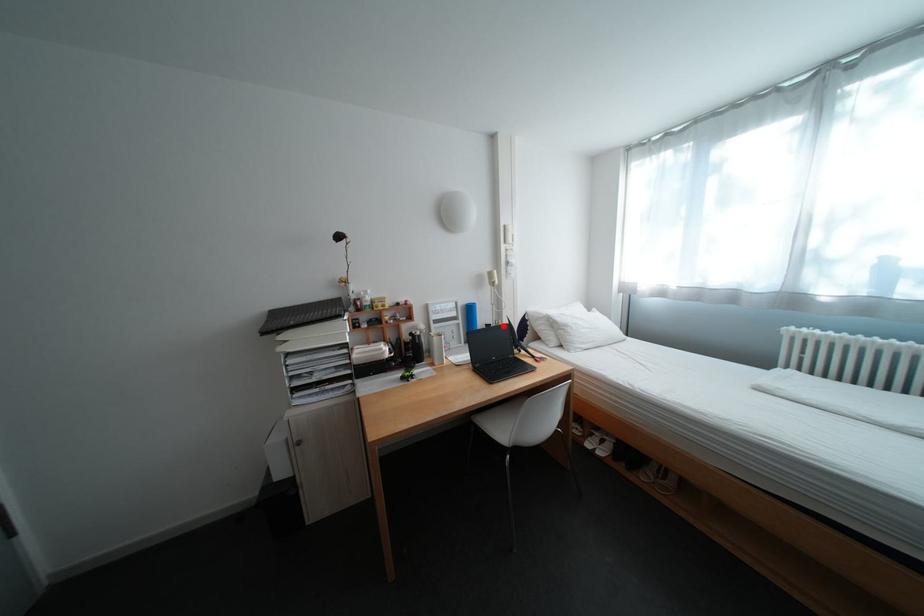
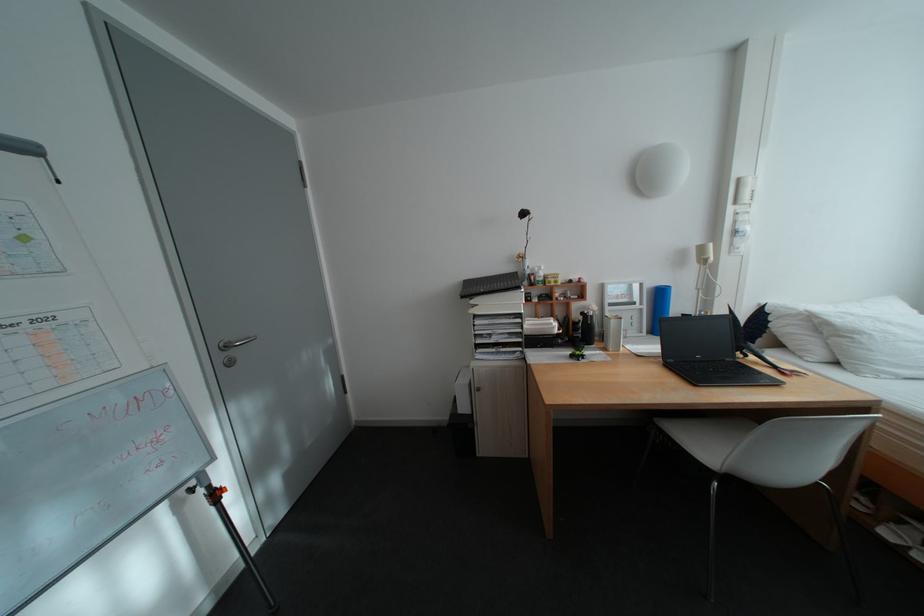
Find the pixel in the second image that matches the highlighted location in the first image.

(703, 315)